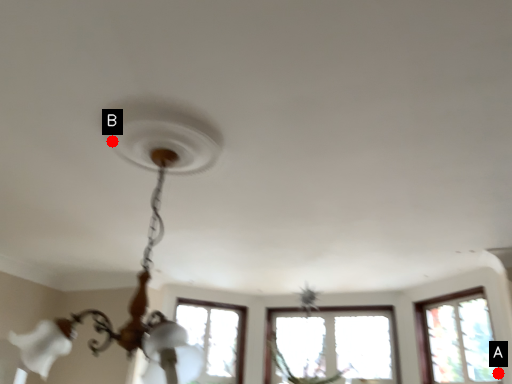
Question: Two points are circled on the image, labeled by A and B beside each circle. Which point is closer to the camera taking this photo?

Choices:
 (A) A is closer
 (B) B is closer

Answer: (B)